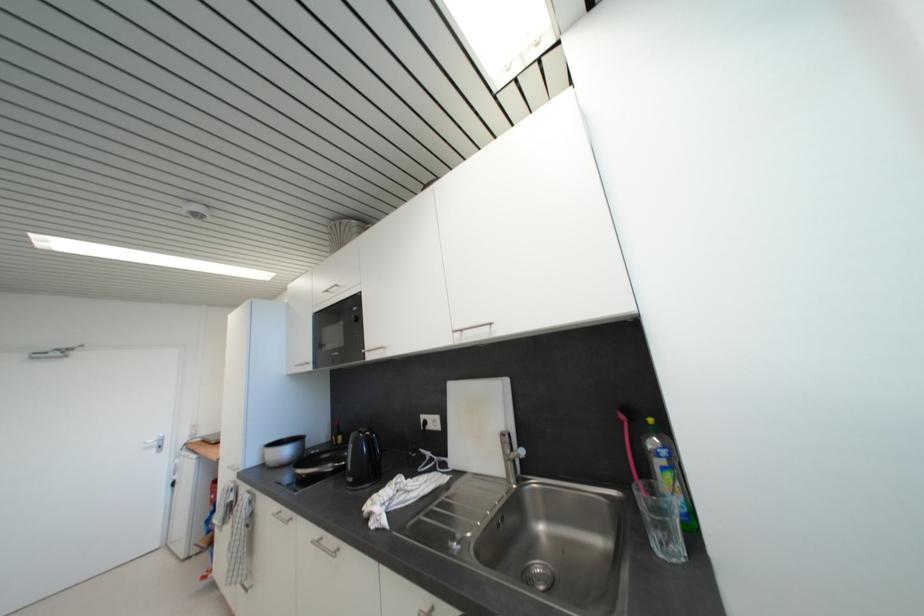
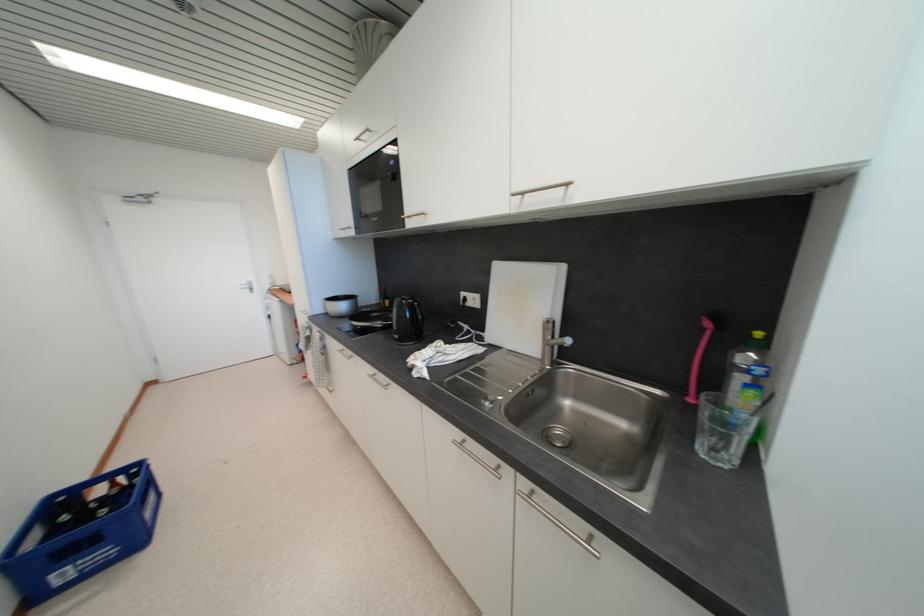
The point at (293, 479) is marked in the first image. Where is the corresponding point in the second image?

(351, 328)